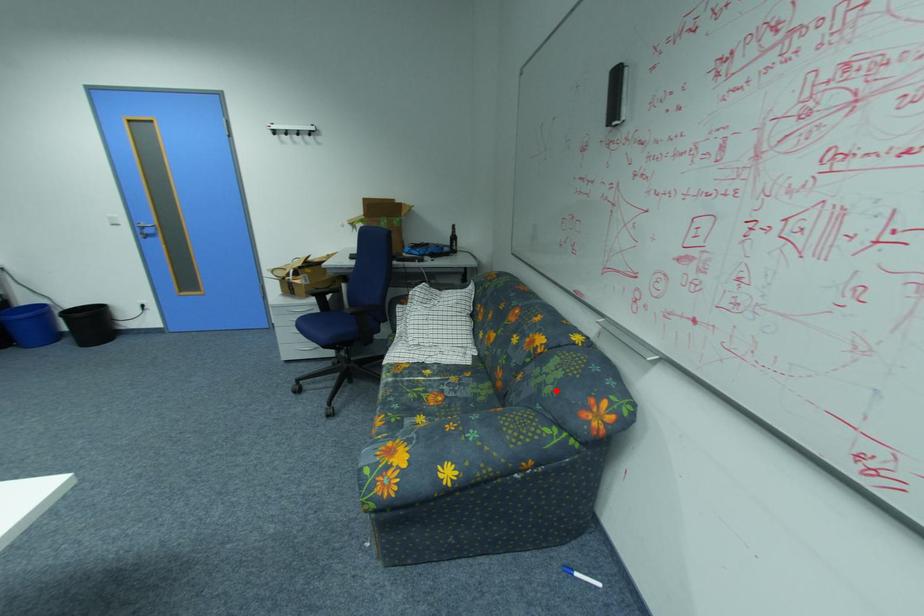
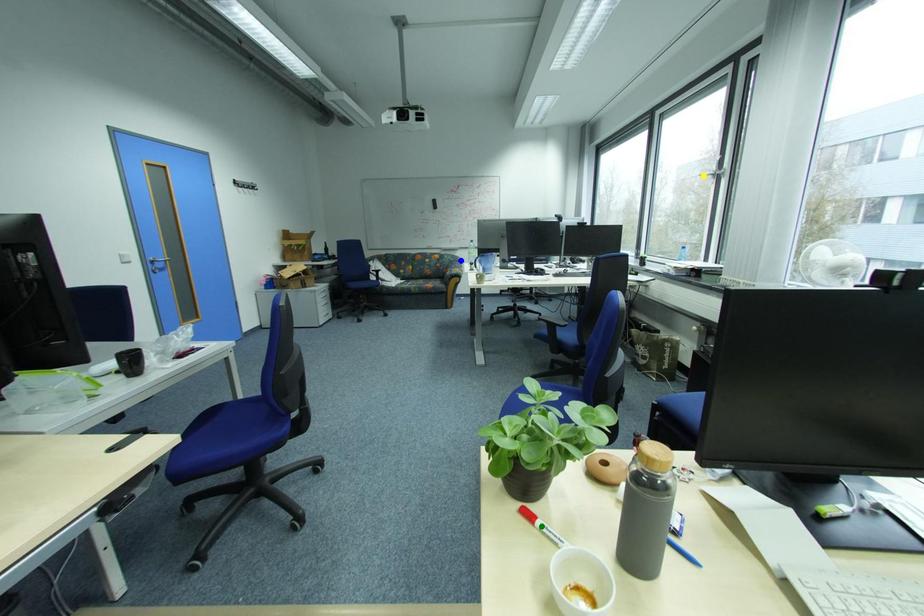
Question: I am providing you with two images of the same scene from different viewpoints. A red point is marked on the first image. You are given multiple points on the second image. Which point in image 2 is actually the same real-world point as the red point in image 1?

Choices:
 (A) yellow point
 (B) blue point
 (C) green point

Answer: (B)